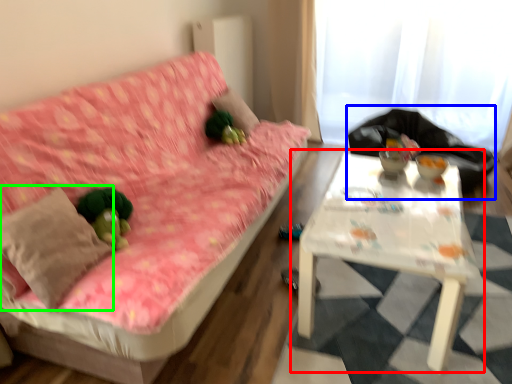
Question: Estimate the real-world distances between objects in this image. Which object is closer to table (highlighted by a red box), sit (highlighted by a blue box) or throw pillow (highlighted by a green box)?

Choices:
 (A) sit
 (B) throw pillow

Answer: (B)